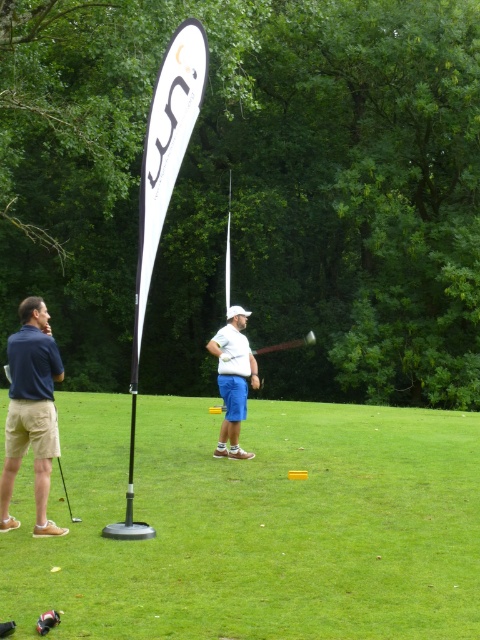
Question: Is green grass at center bigger than white matte golf club at center?

Choices:
 (A) no
 (B) yes

Answer: (B)

Question: Among these points, which one is nearest to the camera?

Choices:
 (A) (265, 353)
 (B) (38, 589)

Answer: (B)

Question: Considering the real-world distances, which object is closest to the dark blue shirt at left?

Choices:
 (A) white matte golf club at center
 (B) green grass at center

Answer: (A)

Question: Is green grass at center bigger than wooden shaft at center?

Choices:
 (A) no
 (B) yes

Answer: (B)

Question: Which object is closer to the camera taking this photo?

Choices:
 (A) white matte golf club at center
 (B) dark blue shirt at left
 (C) wooden shaft at center

Answer: (B)

Question: In this image, where is dark blue shirt at left located relative to white matte golf club at center?

Choices:
 (A) above
 (B) below

Answer: (A)